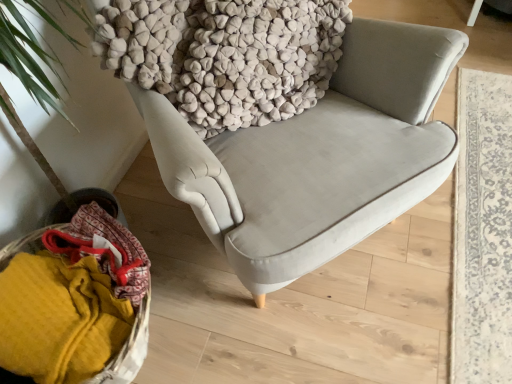
Where is `velvet gray armchair at center`? This screenshot has height=384, width=512. velvet gray armchair at center is located at coordinates (318, 157).

The height and width of the screenshot is (384, 512). What do you see at coordinates (318, 157) in the screenshot?
I see `velvet gray armchair at center` at bounding box center [318, 157].

Where is `velvet gray armchair at center`? Image resolution: width=512 pixels, height=384 pixels. velvet gray armchair at center is located at coordinates (318, 157).